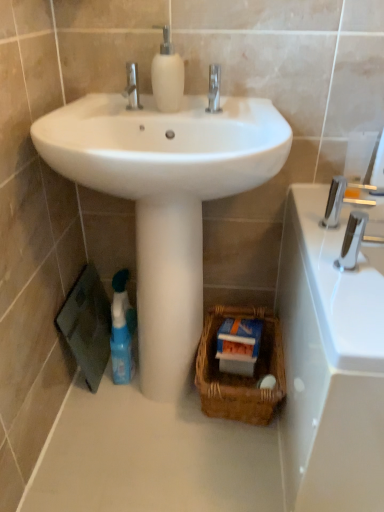
Question: From a real-world perspective, is silver metallic faucet at upper right over polished chrome tap at right?

Choices:
 (A) no
 (B) yes

Answer: (A)

Question: From the image's perspective, is silver metallic faucet at upper right over polished chrome tap at right?

Choices:
 (A) yes
 (B) no

Answer: (A)

Question: Is silver metallic faucet at upper right far from polished chrome tap at right?

Choices:
 (A) yes
 (B) no

Answer: (B)

Question: From a real-world perspective, is silver metallic faucet at upper right under polished chrome tap at right?

Choices:
 (A) yes
 (B) no

Answer: (A)

Question: Is silver metallic faucet at upper right oriented towards polished chrome tap at right?

Choices:
 (A) no
 (B) yes

Answer: (A)

Question: Is silver metallic faucet at upper right closer to the viewer compared to polished chrome tap at right?

Choices:
 (A) no
 (B) yes

Answer: (A)

Question: Is blue glossy bottle at lower left completely or partially outside of polished chrome tap at right?

Choices:
 (A) yes
 (B) no

Answer: (A)

Question: Considering the relative positions of blue glossy bottle at lower left and polished chrome tap at right in the image provided, is blue glossy bottle at lower left to the left of polished chrome tap at right from the viewer's perspective?

Choices:
 (A) yes
 (B) no

Answer: (A)

Question: Does blue glossy bottle at lower left appear on the right side of polished chrome tap at right?

Choices:
 (A) yes
 (B) no

Answer: (B)

Question: Can you confirm if blue glossy bottle at lower left is smaller than polished chrome tap at right?

Choices:
 (A) yes
 (B) no

Answer: (B)

Question: Can you confirm if blue glossy bottle at lower left is taller than polished chrome tap at right?

Choices:
 (A) no
 (B) yes

Answer: (B)

Question: Considering the relative sizes of blue glossy bottle at lower left and polished chrome tap at right in the image provided, is blue glossy bottle at lower left shorter than polished chrome tap at right?

Choices:
 (A) no
 (B) yes

Answer: (A)

Question: From the image's perspective, is brown woven basket at lower center below silver metallic faucet at upper right?

Choices:
 (A) no
 (B) yes

Answer: (B)